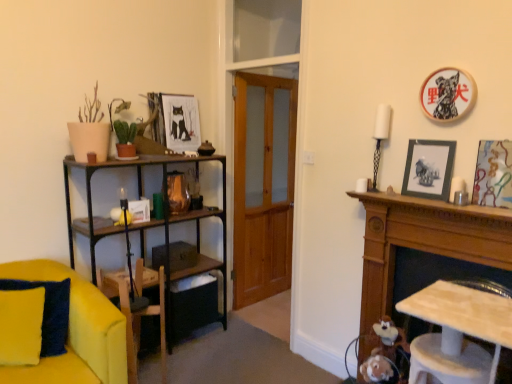
Question: Is wooden armchair at lower left looking in the opposite direction of metallic silver picture frame at right, acting as the 4th picture frame starting from the back?

Choices:
 (A) yes
 (B) no

Answer: (B)

Question: From a real-world perspective, is wooden armchair at lower left positioned under metallic silver picture frame at right, which appears as the 1th picture frame when viewed from the front, based on gravity?

Choices:
 (A) yes
 (B) no

Answer: (A)

Question: From the image's perspective, does wooden armchair at lower left appear lower than metallic silver picture frame at right, placed as the first picture frame when sorted from right to left?

Choices:
 (A) yes
 (B) no

Answer: (A)

Question: Does wooden armchair at lower left turn towards metallic silver picture frame at right, which appears as the 1th picture frame when viewed from the front?

Choices:
 (A) no
 (B) yes

Answer: (A)

Question: From the image's perspective, would you say wooden armchair at lower left is positioned over metallic silver picture frame at right, acting as the 4th picture frame starting from the back?

Choices:
 (A) no
 (B) yes

Answer: (A)

Question: Is wooden armchair at lower left positioned in front of metallic silver picture frame at right, arranged as the fourth picture frame when viewed from the left?

Choices:
 (A) yes
 (B) no

Answer: (B)

Question: Is black glossy picture frame at upper right, the second picture frame from the right, oriented away from matte paper picture frame at upper center, arranged as the first picture frame when viewed from the left?

Choices:
 (A) yes
 (B) no

Answer: (B)

Question: Is black glossy picture frame at upper right, which is the 2th picture frame from front to back, to the right of matte paper picture frame at upper center, arranged as the first picture frame when viewed from the left, from the viewer's perspective?

Choices:
 (A) yes
 (B) no

Answer: (A)

Question: From the image's perspective, does black glossy picture frame at upper right, placed as the third picture frame when sorted from left to right, appear higher than matte paper picture frame at upper center, which appears as the fourth picture frame when viewed from the front?

Choices:
 (A) yes
 (B) no

Answer: (B)

Question: Considering the relative sizes of black glossy picture frame at upper right, positioned as the third picture frame in back-to-front order, and matte paper picture frame at upper center, which appears as the fourth picture frame when viewed from the front, in the image provided, is black glossy picture frame at upper right, positioned as the third picture frame in back-to-front order, taller than matte paper picture frame at upper center, which appears as the fourth picture frame when viewed from the front,?

Choices:
 (A) no
 (B) yes

Answer: (A)

Question: Does black glossy picture frame at upper right, the second picture frame from the right, turn towards matte paper picture frame at upper center, arranged as the first picture frame when viewed from the left?

Choices:
 (A) yes
 (B) no

Answer: (B)

Question: From the image's perspective, is black glossy picture frame at upper right, the second picture frame from the right, below matte paper picture frame at upper center, which appears as the first picture frame when viewed from the back?

Choices:
 (A) yes
 (B) no

Answer: (A)

Question: Can you confirm if matte paper picture frame at upper center, which appears as the first picture frame when viewed from the back, is smaller than wooden armchair at lower left?

Choices:
 (A) yes
 (B) no

Answer: (A)